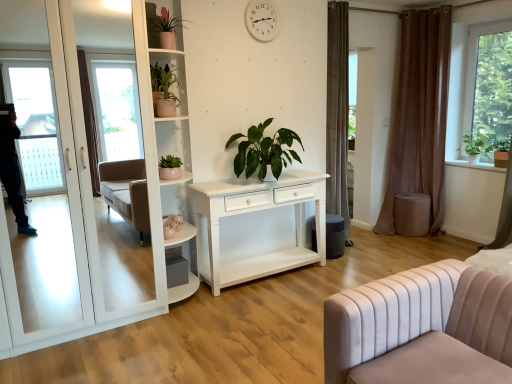
This screenshot has height=384, width=512. What are the coordinates of `vacant area that lies to the right of white glossy screen door at left` in the screenshot? It's located at (185, 337).